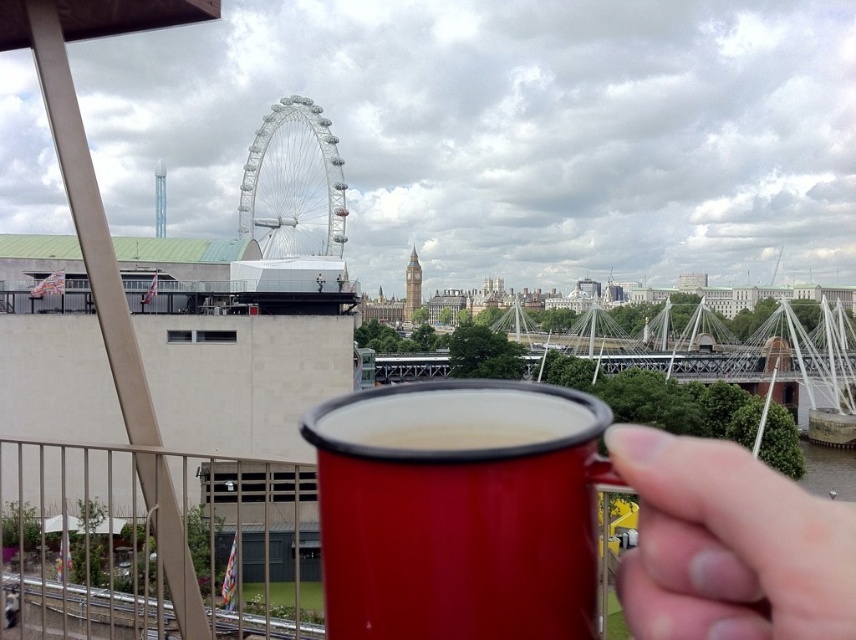
Which is above, matte plastic hand at lower right or red matte mug at center?

red matte mug at center is higher up.

Which is in front, point (759, 604) or point (533, 420)?

Positioned in front is point (759, 604).

Which is behind, point (655, 515) or point (456, 429)?

Positioned behind is point (456, 429).

The width and height of the screenshot is (856, 640). Find the location of `matte plastic hand at lower right`. matte plastic hand at lower right is located at coordinates (729, 545).

Can you confirm if glossy enamel mug at lower right is positioned to the right of white metallic ferris wheel at center?

Indeed, glossy enamel mug at lower right is positioned on the right side of white metallic ferris wheel at center.

Who is more distant from viewer, (343, 531) or (327, 120)?

Point (327, 120)

Which is in front, point (488, 416) or point (306, 140)?

Positioned in front is point (488, 416).

This screenshot has height=640, width=856. What are the coordinates of `glossy enamel mug at lower right` in the screenshot? It's located at (458, 509).

Who is shorter, glossy enamel mug at lower right or matte plastic hand at lower right?

matte plastic hand at lower right is shorter.

Based on the photo, measure the distance between glossy enamel mug at lower right and camera.

A distance of 48.75 meters exists between glossy enamel mug at lower right and camera.

Identify the location of glossy enamel mug at lower right. The width and height of the screenshot is (856, 640). pos(458,509).